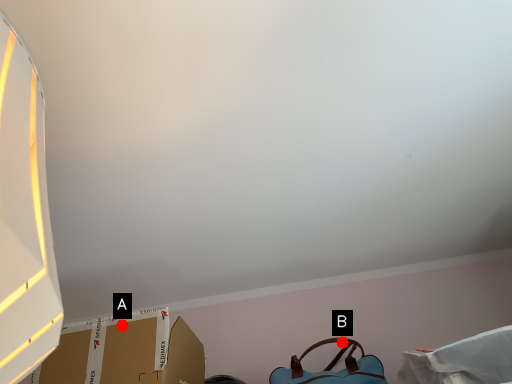
Question: Two points are circled on the image, labeled by A and B beside each circle. Which point is closer to the camera?

Choices:
 (A) A is closer
 (B) B is closer

Answer: (A)